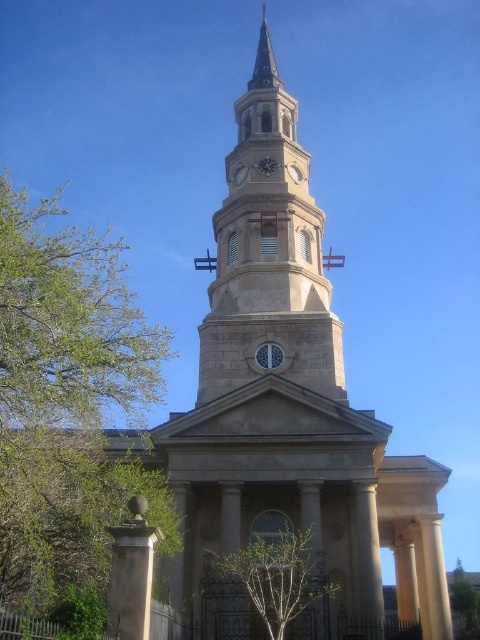
You are standing in front of the church and notice two green leafy trees. One is labeled as the green leafy tree at left and the other as the green leafy tree at center. Which tree is positioned further to the east?

The green leafy tree at left is positioned further to the east because it is to the left of the green leafy tree at center, and in the scene, left corresponds to east.

You are standing in front of the church and notice two green leafy trees. One is labeled as the green leafy tree at left and the other as the green leafy tree at center. Which tree is positioned higher up in the image?

The green leafy tree at left is positioned higher up in the image than the green leafy tree at center.

You are a drone operator planning to fly a drone between the green leafy tree at left and the black metal clock at upper center. The drone has a maximum flight distance of 100 feet. Can the drone safely make this flight without exceeding its range?

The green leafy tree at left and the black metal clock at upper center are 115.70 feet apart from each other. Since the drone can only fly up to 100 feet, it cannot safely make this flight without exceeding its range.